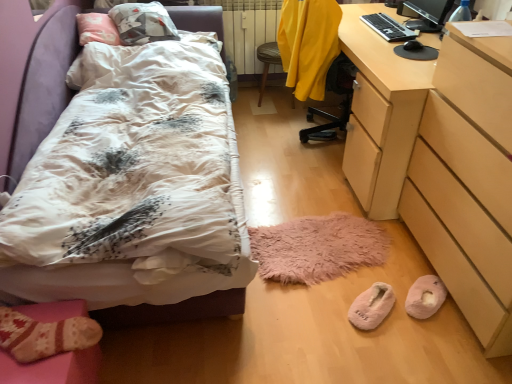
Question: Does yellow fabric swivel chair at center, the second swivel chair when ordered from front to back, have a greater width compared to pink fuzzy slippers at lower center, which ranks as the 2th footwear in right-to-left order?

Choices:
 (A) no
 (B) yes

Answer: (B)

Question: Is yellow fabric swivel chair at center, arranged as the first swivel chair when viewed from the back, facing away from pink fuzzy slippers at lower center, which is counted as the first footwear, starting from the left?

Choices:
 (A) yes
 (B) no

Answer: (B)

Question: Is yellow fabric swivel chair at center, the second swivel chair when ordered from front to back, in contact with pink fuzzy slippers at lower center, which ranks as the 2th footwear in right-to-left order?

Choices:
 (A) no
 (B) yes

Answer: (A)

Question: Considering the relative sizes of yellow fabric swivel chair at center, the second swivel chair when ordered from front to back, and pink fuzzy slippers at lower center, which is counted as the first footwear, starting from the left, in the image provided, is yellow fabric swivel chair at center, the second swivel chair when ordered from front to back, bigger than pink fuzzy slippers at lower center, which is counted as the first footwear, starting from the left,?

Choices:
 (A) yes
 (B) no

Answer: (A)

Question: Is the depth of yellow fabric swivel chair at center, arranged as the first swivel chair when viewed from the back, greater than that of pink fuzzy slippers at lower center, which ranks as the 2th footwear in right-to-left order?

Choices:
 (A) no
 (B) yes

Answer: (B)

Question: Is black glossy monitor at upper right taller or shorter than pink fuzzy slippers at lower center, which is counted as the first footwear, starting from the left?

Choices:
 (A) short
 (B) tall

Answer: (B)

Question: Relative to pink fuzzy slippers at lower center, which ranks as the 2th footwear in right-to-left order, is black glossy monitor at upper right in front or behind?

Choices:
 (A) front
 (B) behind

Answer: (B)

Question: Would you say black glossy monitor at upper right is inside or outside pink fuzzy slippers at lower center, which ranks as the 2th footwear in right-to-left order?

Choices:
 (A) inside
 (B) outside

Answer: (B)

Question: From the image's perspective, is black glossy monitor at upper right positioned above or below pink fuzzy slippers at lower center, which ranks as the 2th footwear in right-to-left order?

Choices:
 (A) below
 (B) above

Answer: (B)

Question: In terms of height, does white floral duvet at left look taller or shorter compared to yellow fabric swivel chair at center, arranged as the first swivel chair when viewed from the back?

Choices:
 (A) tall
 (B) short

Answer: (B)

Question: Considering the positions of point (212, 16) and point (263, 56), is point (212, 16) closer or farther from the camera than point (263, 56)?

Choices:
 (A) farther
 (B) closer

Answer: (B)

Question: In the image, is white floral duvet at left on the left side or the right side of yellow fabric swivel chair at center, the second swivel chair when ordered from front to back?

Choices:
 (A) left
 (B) right

Answer: (A)

Question: Considering their positions, is white floral duvet at left located in front of or behind yellow fabric swivel chair at center, arranged as the first swivel chair when viewed from the back?

Choices:
 (A) front
 (B) behind

Answer: (A)

Question: Is knitted wool socks at lower left in front of or behind black plastic keyboard at upper right in the image?

Choices:
 (A) behind
 (B) front

Answer: (B)

Question: In terms of height, does knitted wool socks at lower left look taller or shorter compared to black plastic keyboard at upper right?

Choices:
 (A) short
 (B) tall

Answer: (B)